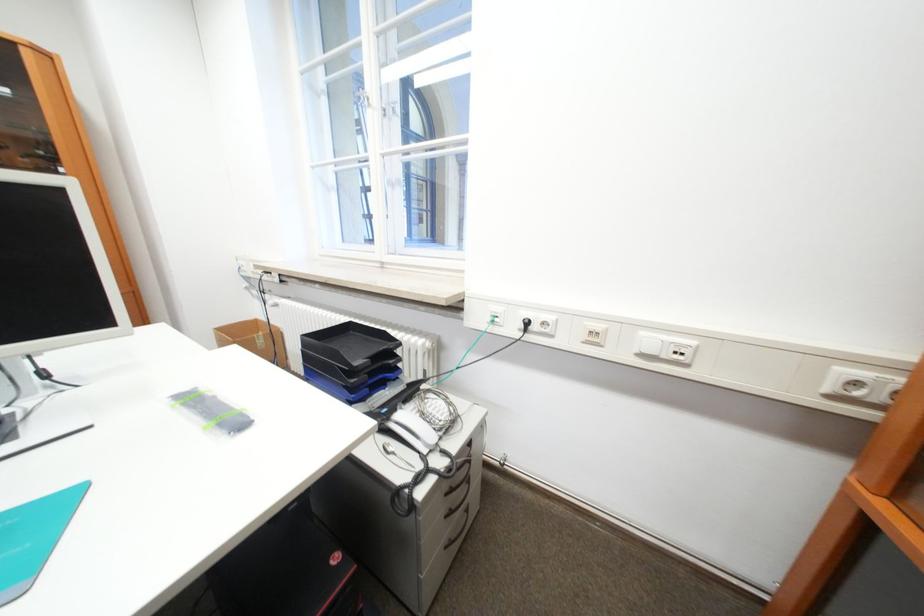
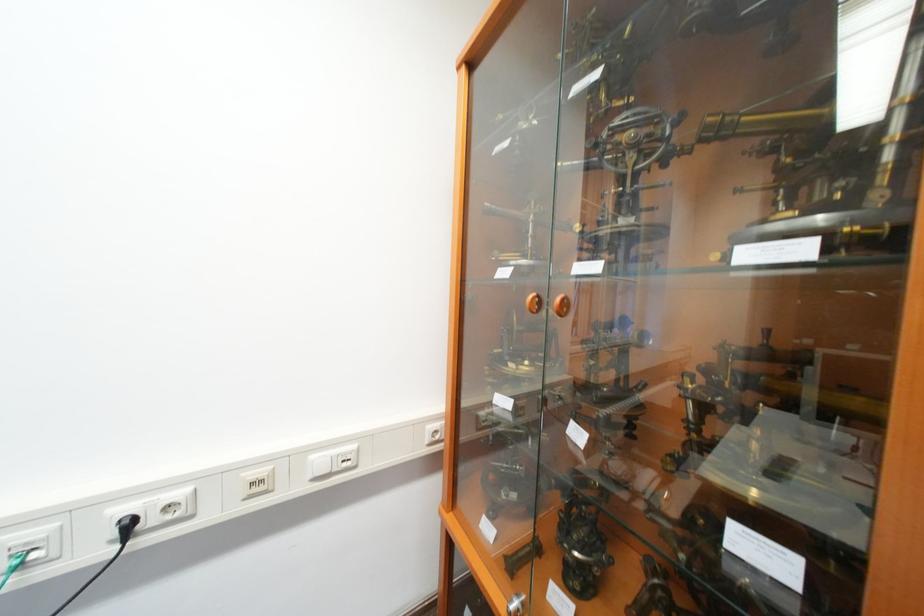
In the second image, find the point that corresponds to (601,334) in the first image.

(261, 485)